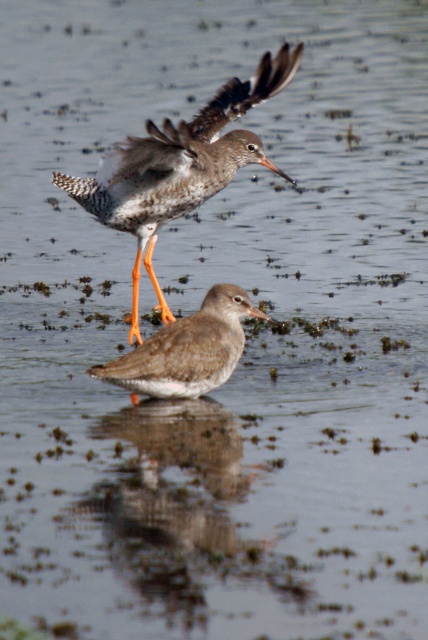
Which of these two, speckled feathered bird at upper center or brown speckled sandpiper at center, stands taller?

Standing taller between the two is speckled feathered bird at upper center.

Consider the image. Does speckled feathered bird at upper center appear over brown speckled sandpiper at center?

Yes.

What do you see at coordinates (178, 166) in the screenshot? I see `speckled feathered bird at upper center` at bounding box center [178, 166].

At what (x,y) coordinates should I click in order to perform the action: click on speckled feathered bird at upper center. Please return your answer as a coordinate pair (x, y). The image size is (428, 640). Looking at the image, I should click on (178, 166).